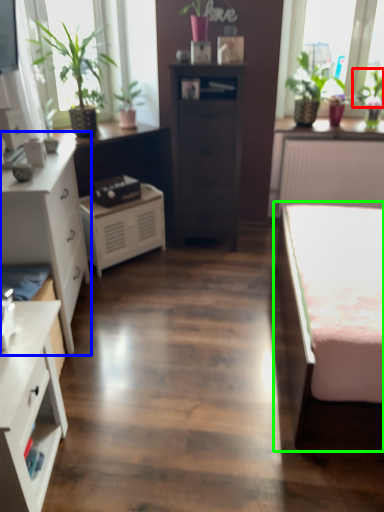
Question: Which object is positioned closest to plant (highlighted by a red box)? Select from chest of drawers (highlighted by a blue box) and bed (highlighted by a green box).

Choices:
 (A) chest of drawers
 (B) bed

Answer: (B)